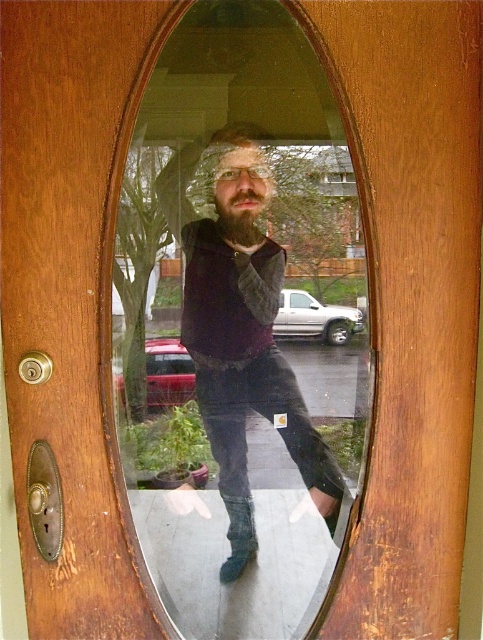
Based on the photo, how far apart are clear glass mirror at center and matte black sweater at center?

clear glass mirror at center and matte black sweater at center are 2.78 inches apart from each other.

The width and height of the screenshot is (483, 640). I want to click on clear glass mirror at center, so click(240, 324).